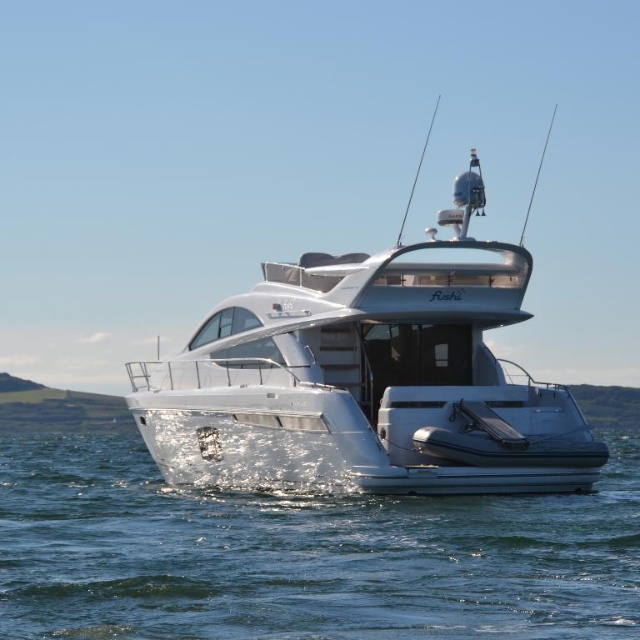
Question: Considering the relative positions of clear water at lower center and silver metallic boat at center in the image provided, where is clear water at lower center located with respect to silver metallic boat at center?

Choices:
 (A) above
 (B) below

Answer: (B)

Question: Is clear water at lower center bigger than silver metallic boat at center?

Choices:
 (A) yes
 (B) no

Answer: (B)

Question: Which point is farther to the camera?

Choices:
 (A) (86, 621)
 (B) (234, 387)

Answer: (B)

Question: Is the position of clear water at lower center less distant than that of silver metallic boat at center?

Choices:
 (A) no
 (B) yes

Answer: (B)

Question: Which of the following is the farthest from the observer?

Choices:
 (A) (284, 516)
 (B) (253, 401)

Answer: (B)